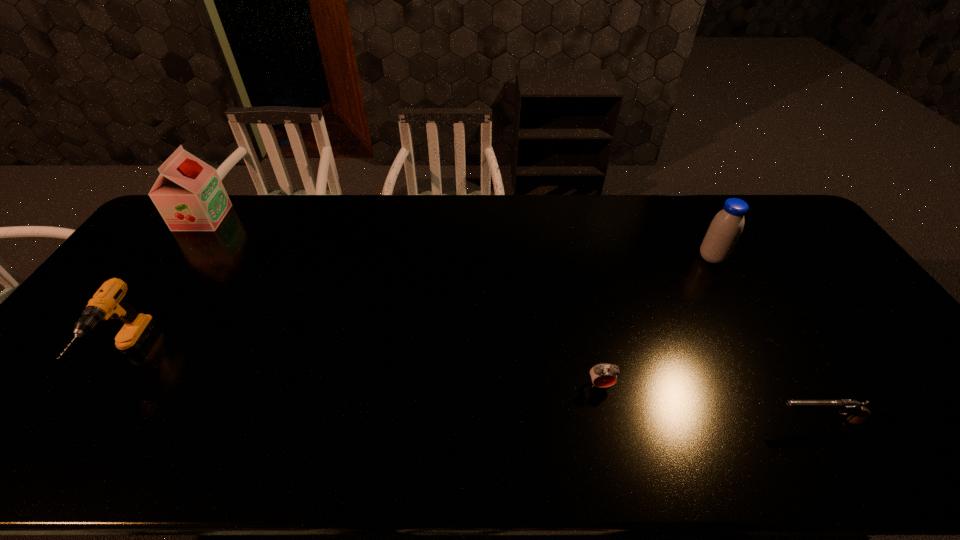
Identify the location of free region located on the face of the third object from left to right. The width and height of the screenshot is (960, 540). (612, 434).

Locate an element on the screen. free region located 0.060m aiming along the barrel of the nearest object is located at coordinates (744, 422).

Image resolution: width=960 pixels, height=540 pixels. I want to click on vacant space positioned 0.210m aiming along the barrel of the nearest object, so click(679, 422).

Identify the location of free space located aiming along the barrel of the nearest object. (692, 422).

The width and height of the screenshot is (960, 540). I want to click on object that is at the far edge, so click(189, 195).

Find the location of a particular element. The image size is (960, 540). object situated at the left edge is located at coordinates (189, 195).

Locate an element on the screen. The height and width of the screenshot is (540, 960). object situated at the far left corner is located at coordinates (189, 195).

Where is `free point at the far edge`? free point at the far edge is located at coordinates (256, 201).

Locate an element on the screen. The width and height of the screenshot is (960, 540). vacant space at the near edge is located at coordinates (585, 441).

In the image, there is a desktop. Where is `vacant space at the left edge`? The image size is (960, 540). vacant space at the left edge is located at coordinates (71, 356).